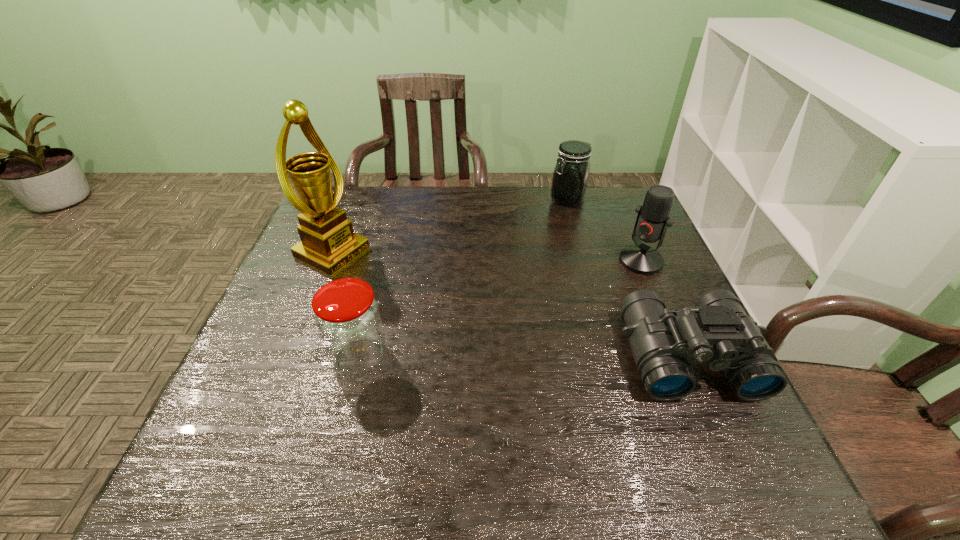
Where is `microphone that is positioned at the right edge`? The width and height of the screenshot is (960, 540). microphone that is positioned at the right edge is located at coordinates click(653, 219).

Where is `object that is at the near right corner`? The height and width of the screenshot is (540, 960). object that is at the near right corner is located at coordinates (717, 330).

Find the location of a particular element. Image resolution: width=960 pixels, height=540 pixels. vacant region at the far edge of the desktop is located at coordinates (401, 191).

This screenshot has height=540, width=960. In the image, there is a desktop. Identify the location of free space at the near edge. (559, 406).

In the image, there is a desktop. In order to click on vacant area at the left edge in this screenshot , I will do `click(276, 357)`.

Find the location of a particular element. vacant space at the right edge of the desktop is located at coordinates (618, 288).

This screenshot has width=960, height=540. Find the location of `free region at the far left corner of the desktop`. free region at the far left corner of the desktop is located at coordinates point(367,198).

In the image, there is a desktop. What are the coordinates of `vacant space at the far right corner` in the screenshot? It's located at (x=593, y=208).

You are a GUI agent. You are given a task and a screenshot of the screen. Output one action in this format:
    pyautogui.click(x=<x>, y=<y>)
    Task: Click on the vacant area between the farther jar and the second tallest object
    The width and height of the screenshot is (960, 540).
    Given the screenshot: What is the action you would take?
    pyautogui.click(x=604, y=230)

In order to click on empty location between the binoculars and the award in this screenshot , I will do pos(510,305).